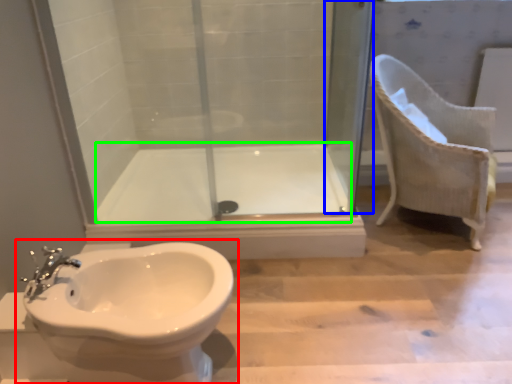
Question: Estimate the real-world distances between objects in this image. Which object is farther from toilet (highlighted by a red box), screen door (highlighted by a blue box) or bath (highlighted by a green box)?

Choices:
 (A) screen door
 (B) bath

Answer: (A)